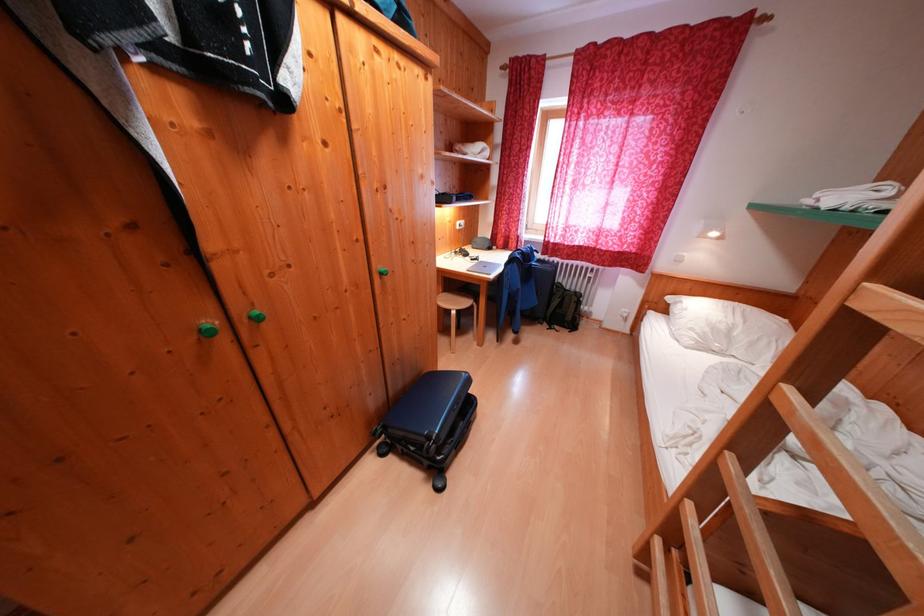
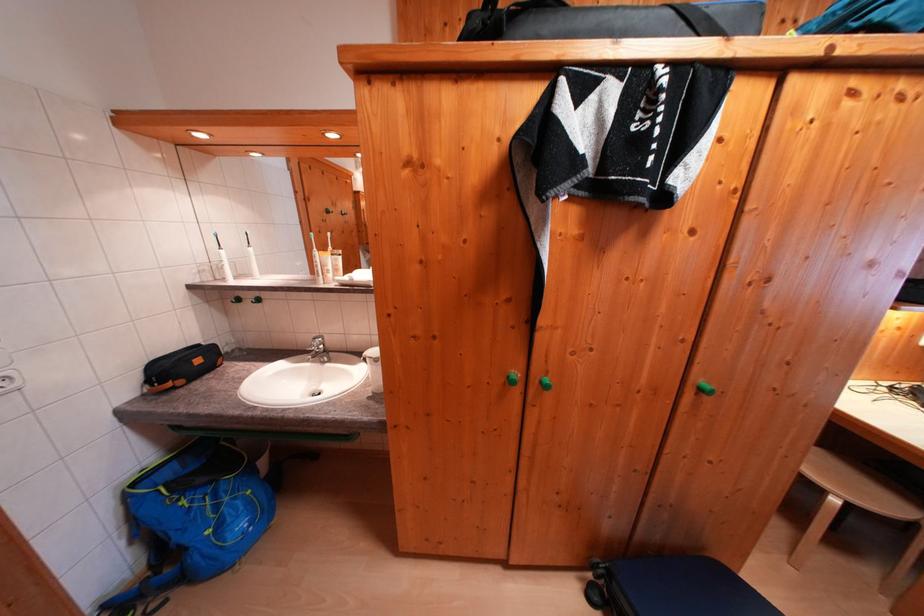
Question: How did the camera likely rotate?

Choices:
 (A) Left
 (B) Right
 (C) Up
 (D) Down

Answer: (A)